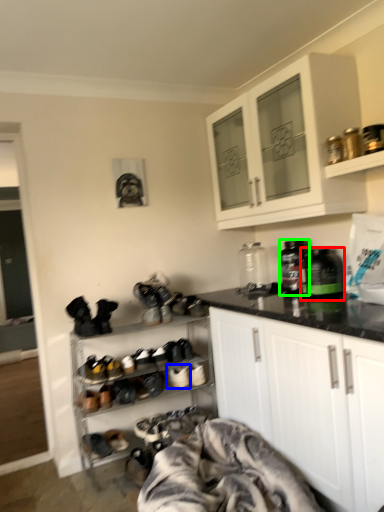
Question: Which object is the farthest from bottle (highlighted by a red box)? Choose among these: footwear (highlighted by a blue box) or bottle (highlighted by a green box).

Choices:
 (A) footwear
 (B) bottle

Answer: (A)